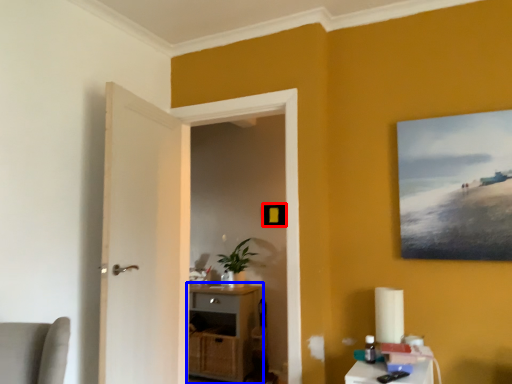
Question: Which object appears closest to the camera in this image, picture frame (highlighted by a red box) or cabinetry (highlighted by a blue box)?

Choices:
 (A) picture frame
 (B) cabinetry

Answer: (B)